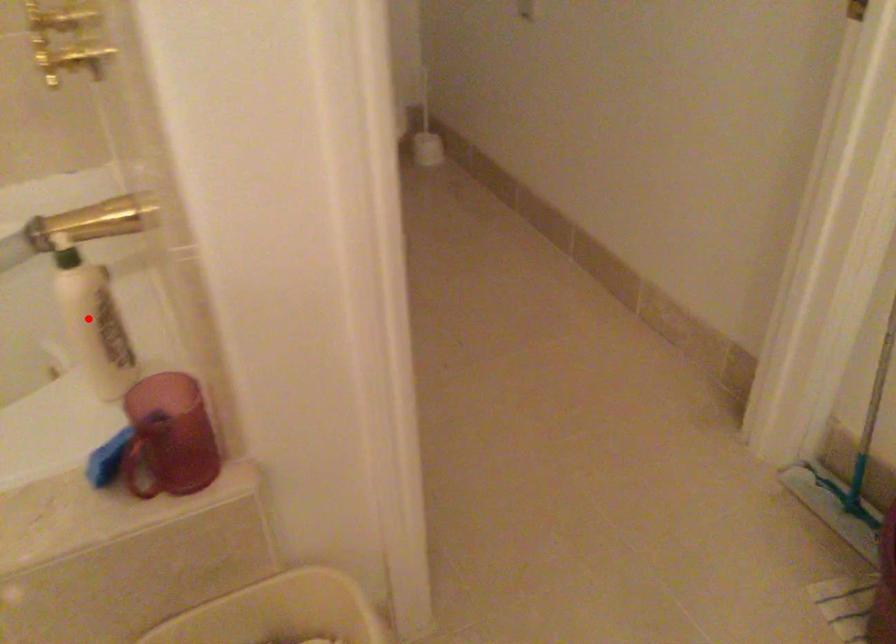
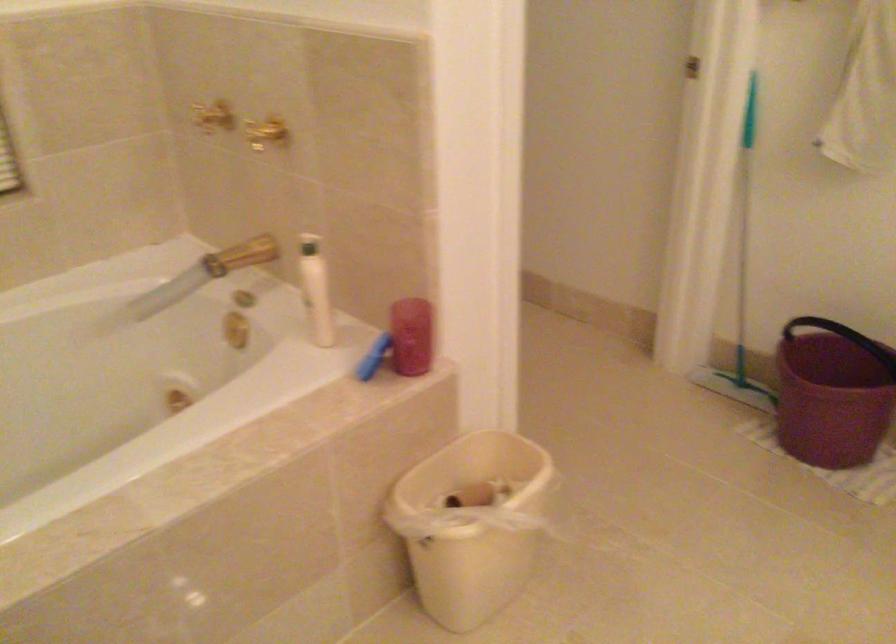
Where in the second image is the point corresponding to the highlighted location from the first image?

(315, 289)